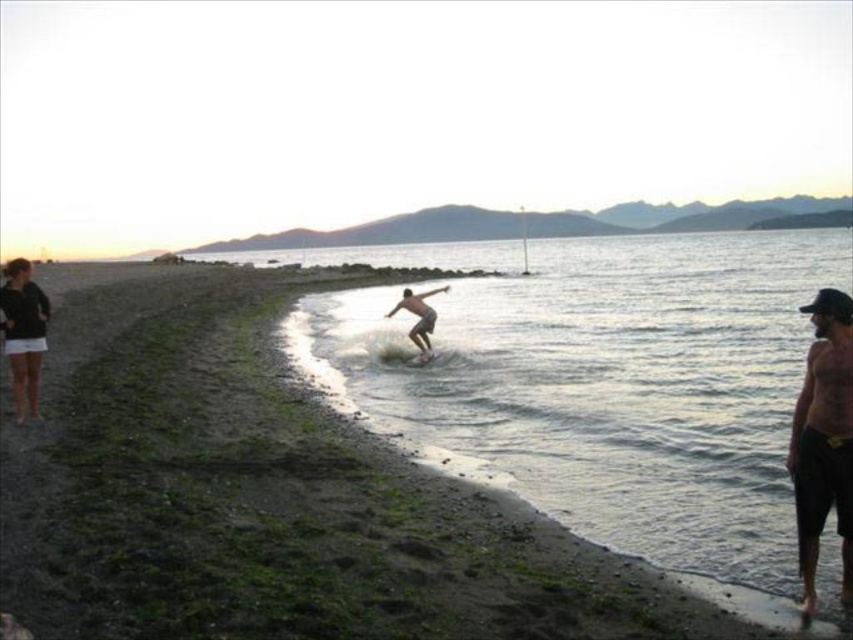
Question: Based on their relative distances, which object is nearer to the clear water at center?

Choices:
 (A) smooth tan surfboard at center
 (B) black matte shorts at right

Answer: (A)

Question: Among these objects, which one is farthest from the camera?

Choices:
 (A) black matte shorts at right
 (B) smooth tan surfboard at center
 (C) clear water at center

Answer: (B)

Question: Can you confirm if clear water at center is positioned below white foam surfboard at center?

Choices:
 (A) no
 (B) yes

Answer: (A)

Question: Can you confirm if clear water at center is thinner than smooth tan surfboard at center?

Choices:
 (A) yes
 (B) no

Answer: (B)

Question: Observing the image, what is the correct spatial positioning of clear water at center in reference to white foam surfboard at center?

Choices:
 (A) above
 (B) below

Answer: (A)

Question: Which object appears farthest from the camera in this image?

Choices:
 (A) smooth tan surfboard at center
 (B) black matte shorts at right
 (C) clear water at center
 (D) white foam surfboard at center

Answer: (A)